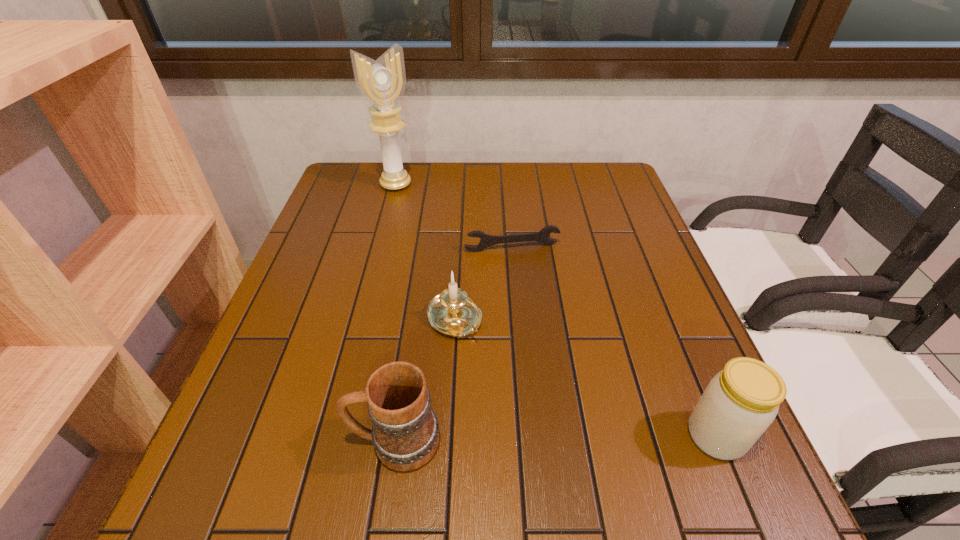
What are the coordinates of `vacant space on the desktop that is between the mug and the rightmost object and is positioned on the open ends of the wrench` in the screenshot? It's located at (569, 438).

Locate an element on the screen. The height and width of the screenshot is (540, 960). vacant spot on the desktop that is between the mug and the rightmost object and is positioned on the front-facing side of the tallest object is located at coordinates (579, 438).

Where is `free spot on the desktop that is between the mug and the rightmost object and is positioned on the handle side of the fourth tallest object`? The height and width of the screenshot is (540, 960). free spot on the desktop that is between the mug and the rightmost object and is positioned on the handle side of the fourth tallest object is located at coordinates (551, 438).